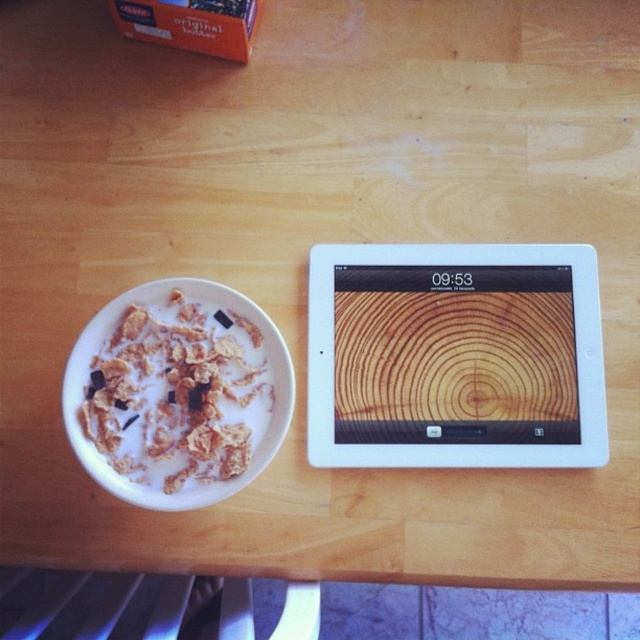
In the scene shown: You are looking at a wooden table with various items. There is a point labeled at coordinate [454,356]. What object is located at that coordinate?

The point at coordinate [454,356] indicates the white glossy tablet at upper center.

Based on the photo, you are trying to place the white glossy tablet at upper center on top of the white matte bowl at left. Will the tablet fit on the bowl without overhanging the edges?

The white glossy tablet at upper center might be wider than the white matte bowl at left, so there is a possibility that the tablet could overhang the edges of the bowl.

You are trying to reach the white glossy tablet at upper center on the table but need to move the white matte bowl at left first. Can you lift the bowl without knocking over the tablet?

The white glossy tablet at upper center is located above the white matte bowl at left, so lifting the bowl won